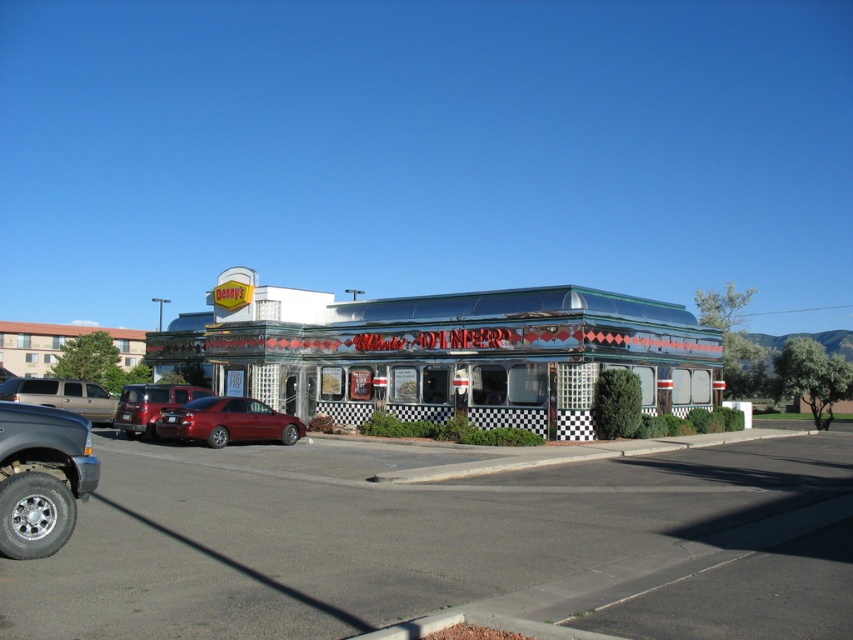
Can you confirm if glossy red sedan at center is thinner than metallic red sedan at center-left?

Indeed, glossy red sedan at center has a lesser width compared to metallic red sedan at center-left.

Which is behind, point (268, 417) or point (148, 433)?

Point (148, 433)

Which is behind, point (218, 442) or point (149, 428)?

The point (149, 428) is behind.

Image resolution: width=853 pixels, height=640 pixels. In order to click on glossy red sedan at center in this screenshot , I will do `click(227, 422)`.

Is point (299, 358) behind point (173, 406)?

Yes, point (299, 358) is farther from viewer.

Who is higher up, metallic diner at center or metallic red sedan at center-left?

metallic diner at center is above.

Who is more forward, (572, 356) or (193, 396)?

Point (572, 356) is more forward.

I want to click on metallic diner at center, so click(x=450, y=355).

Is point (741, 444) behind point (70, 380)?

No, it is not.

Does point (202, 609) come behind point (32, 403)?

That is False.

In order to click on smooth asphalt parking lot at lower left in this screenshot , I will do `click(447, 545)`.